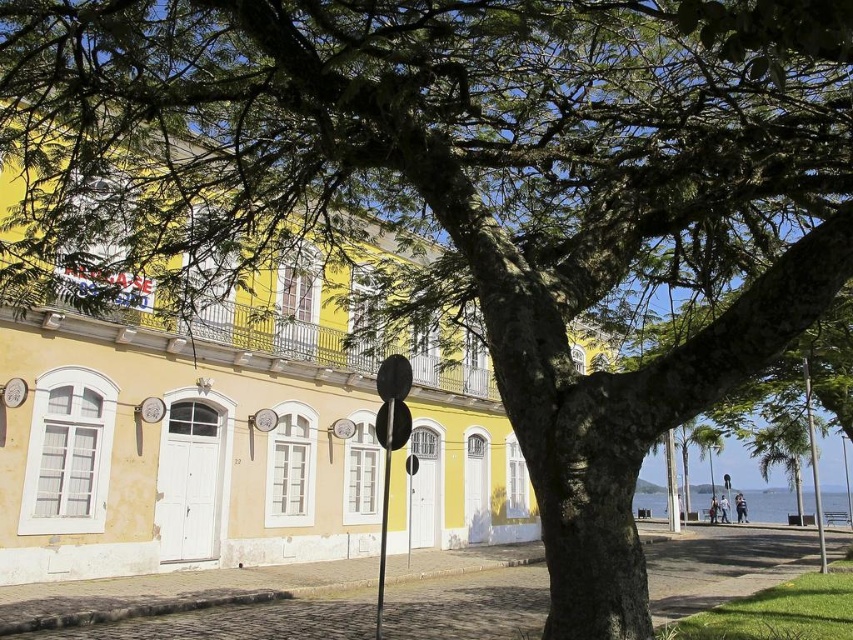
You are a city planner assessing the street layout. You need to determine if the green leafy tree at lower right can be moved closer to the metallic pole at right without overlapping. Based on their widths, is this feasible?

The green leafy tree at lower right has a lesser width compared to the metallic pole at right, so moving the tree closer to the pole is feasible as long as their combined widths do not exceed the available space between them.

You are a city planner assessing the safety of a new traffic camera installation. The camera is positioned to monitor the street in front of the yellow building. According to the image, how far apart are the metallic pole at right and the camera?

The metallic pole at right and the camera are 11.55 meters apart.